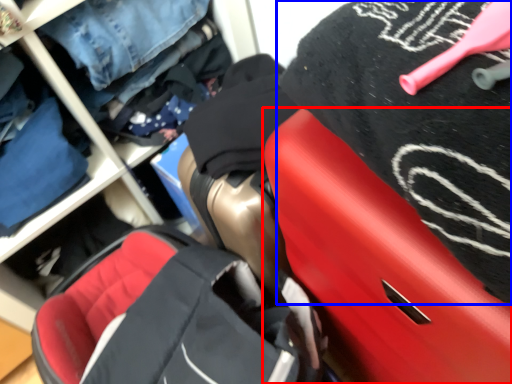
Question: Among these objects, which one is farthest to the camera, luggage (highlighted by a red box) or clothing (highlighted by a blue box)?

Choices:
 (A) luggage
 (B) clothing

Answer: (A)